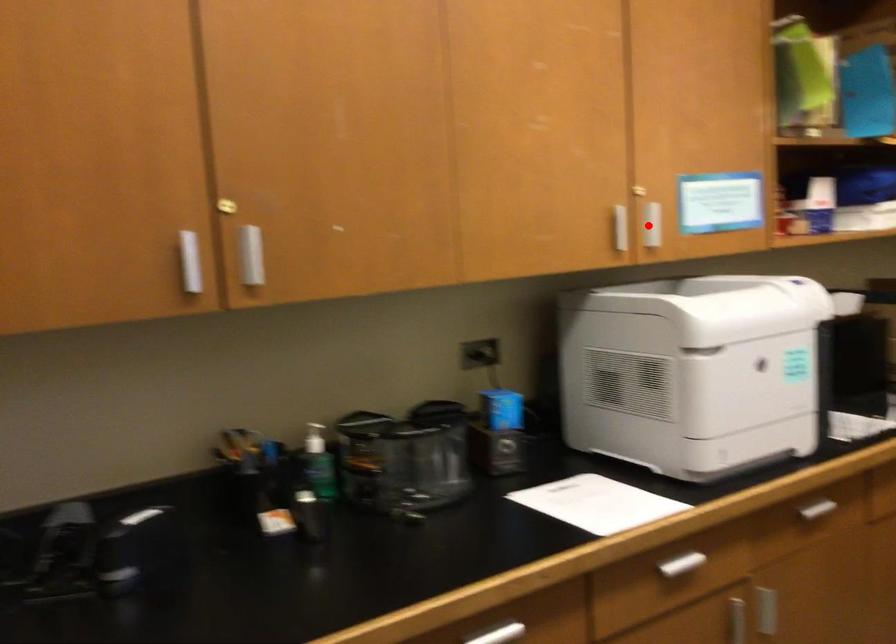
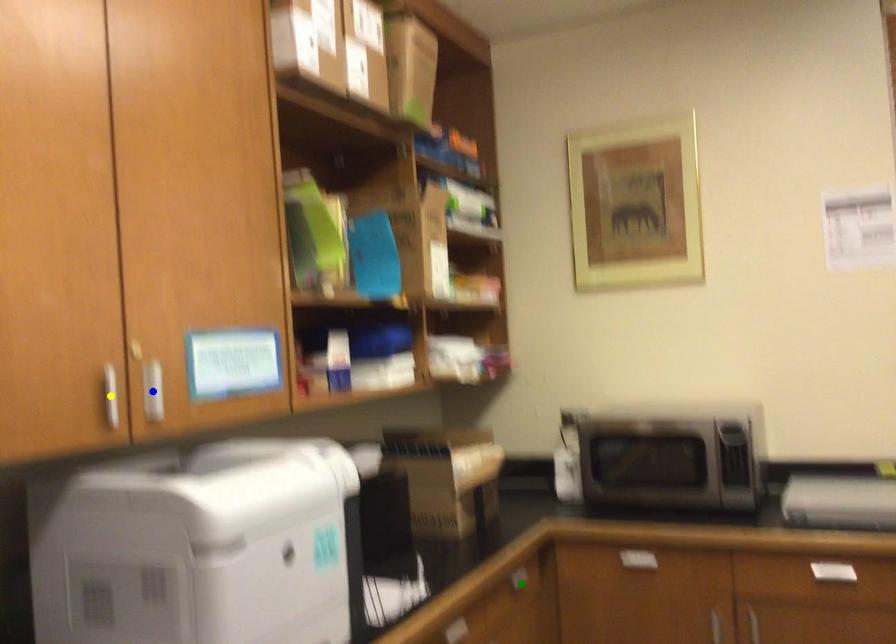
Question: I am providing you with two images of the same scene from different viewpoints. A red point is marked on the first image. You are given multiple points on the second image. Which mark in image 2 goes with the point in image 1?

Choices:
 (A) blue point
 (B) green point
 (C) yellow point

Answer: (A)